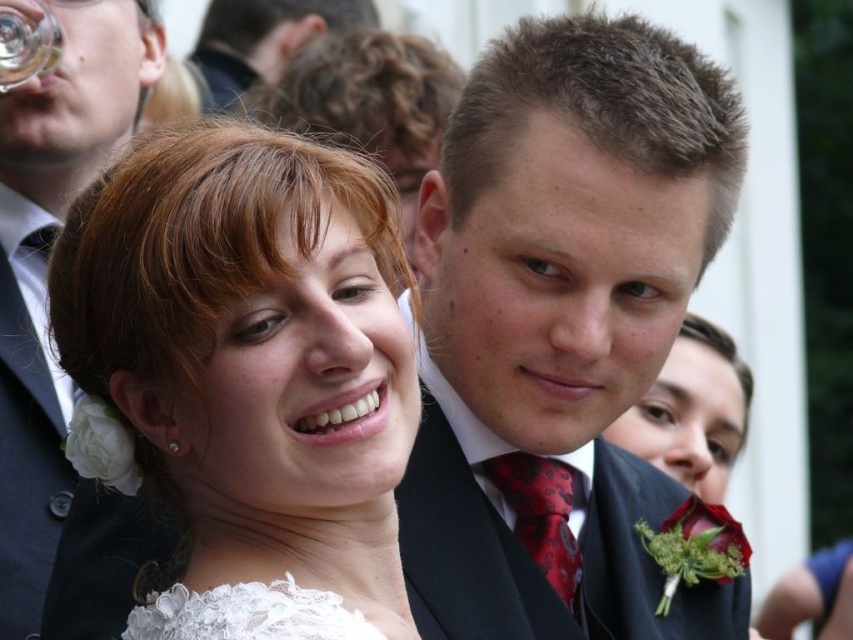
Which is below, matte black suit at center or transparent glass at upper left?

matte black suit at center

Which is in front, point (468, 211) or point (42, 56)?

Point (468, 211)

Locate an element on the screen. matte black suit at center is located at coordinates (561, 330).

Between point (556, 304) and point (555, 592), which one is positioned behind?

The point (555, 592) is behind.

Which of these two, matte black suit at center or red satin tie at center, stands taller?

matte black suit at center is taller.

What are the coordinates of `matte black suit at center` in the screenshot? It's located at (561, 330).

Does matte black suit at upper left appear on the right side of red satin tie at center?

In fact, matte black suit at upper left is to the left of red satin tie at center.

Between point (53, 90) and point (529, 541), which one is positioned in front?

Point (529, 541) is more forward.

The height and width of the screenshot is (640, 853). I want to click on matte black suit at upper left, so click(x=45, y=259).